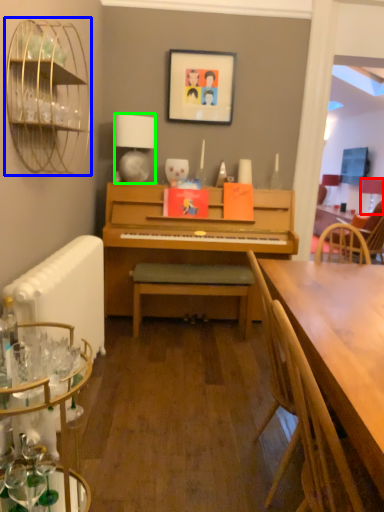
Question: Which is farther away from lamp (highlighted by a red box)? bird cage (highlighted by a blue box) or lamp (highlighted by a green box)?

Choices:
 (A) bird cage
 (B) lamp

Answer: (A)